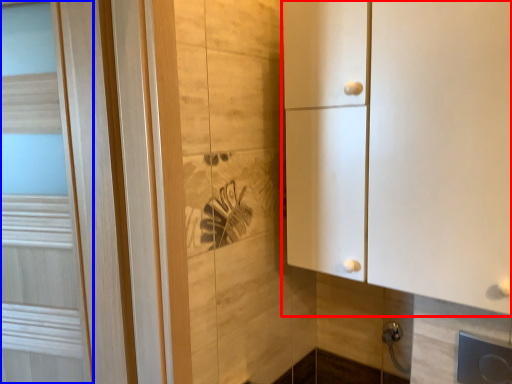
Question: Which object appears farthest to the camera in this image, cupboard (highlighted by a red box) or door (highlighted by a blue box)?

Choices:
 (A) cupboard
 (B) door

Answer: (B)